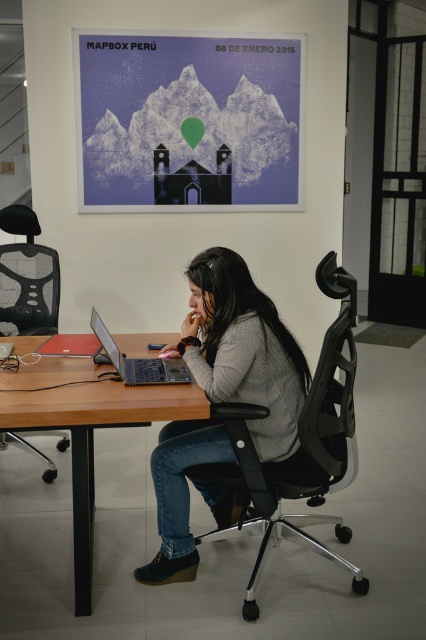
You are a delivery person who needs to place a package on the floor between the black mesh office chair at center and the wooden table at center. The package is 20 inches long. Can you fit the package horizontally between them without moving either object?

The black mesh office chair at center is 21.63 inches from the wooden table at center. Since the package is 20 inches long, it can fit horizontally between them as the distance is sufficient.

You are standing in the office and want to reach the matte paper poster at upper center. The office has a 4 meter high ceiling. Can you touch the poster without any assistance?

The matte paper poster at upper center is 3.98 meters away from the viewer. Since the ceiling is 4 meters high, you can barely reach it if you jump or stand on the chair, but it might be difficult without assistance.